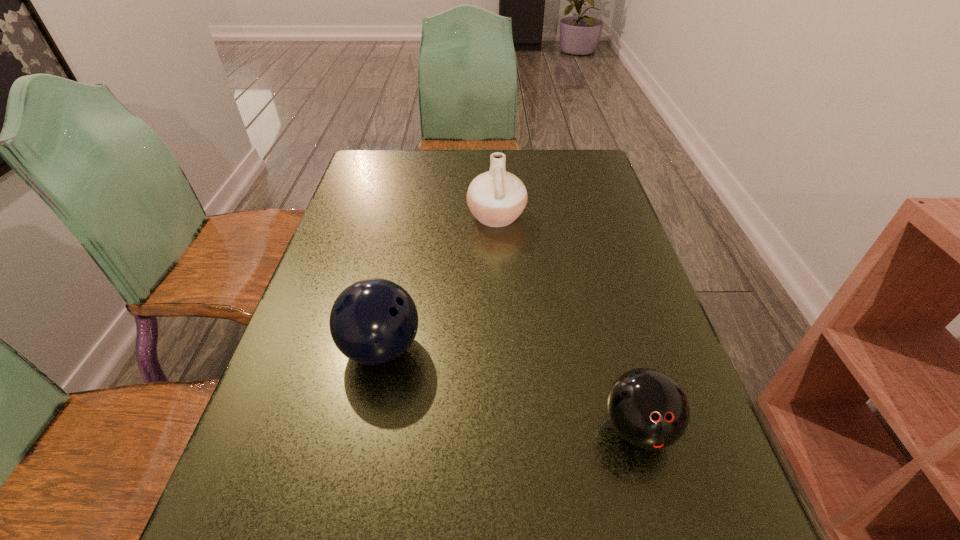
At what (x,y) coordinates should I click in order to perform the action: click on the farthest object. Please return your answer as a coordinate pair (x, y). Looking at the image, I should click on pos(496,198).

Where is `the second object from right to left`? The height and width of the screenshot is (540, 960). the second object from right to left is located at coordinates (496, 198).

Where is `the leftmost object`? The image size is (960, 540). the leftmost object is located at coordinates (374, 321).

This screenshot has height=540, width=960. I want to click on the second nearest object, so click(x=374, y=321).

Locate an element on the screen. This screenshot has height=540, width=960. the shorter bowling ball is located at coordinates (647, 408).

In order to click on the right bowling ball in this screenshot , I will do `click(647, 408)`.

The width and height of the screenshot is (960, 540). Find the location of `vacant space located 0.330m to pour from the handle of the pottery`. vacant space located 0.330m to pour from the handle of the pottery is located at coordinates (349, 216).

Where is `blank space located to pour from the handle of the pottery`? The width and height of the screenshot is (960, 540). blank space located to pour from the handle of the pottery is located at coordinates (442, 216).

I want to click on vacant space located to pour from the handle of the pottery, so click(x=374, y=216).

Find the location of a particular element. vacant area situated 0.130m on the surface of the second nearest object near the finger holes is located at coordinates (486, 348).